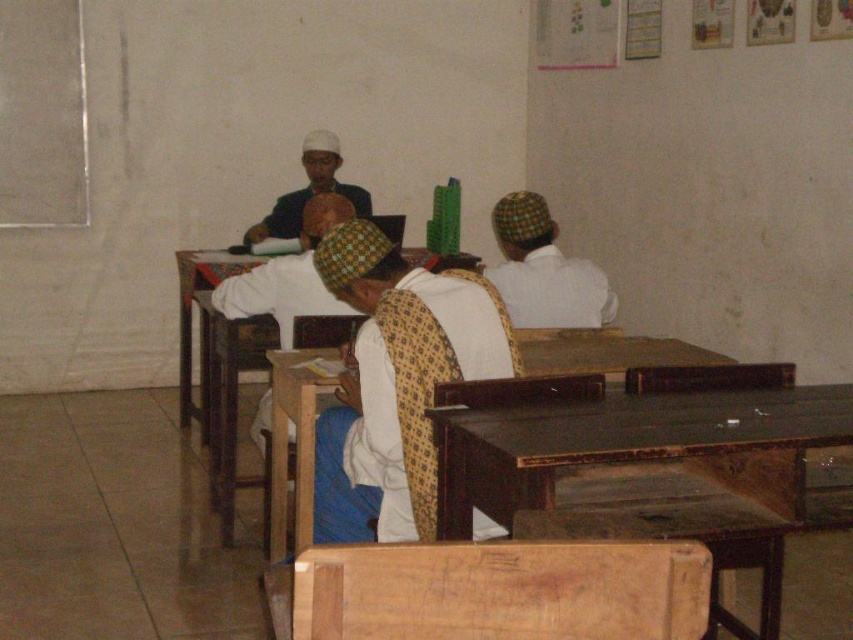
In the scene shown: You are a student in the classroom and want to hand in your assignment to the teacher. The teacher is standing behind the white cloth at upper center. However, there is a white cotton shirt at center blocking your view. Can you see the teacher?

The white cotton shirt at center is in front of the white cloth at upper center, so the white cotton shirt at center is blocking your view of the teacher behind the white cloth at upper center. Therefore, you cannot see the teacher.